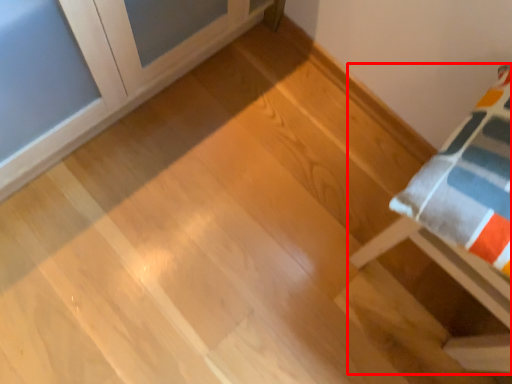
Question: From the image's perspective, where is furniture (annotated by the red box) located relative to furniture?

Choices:
 (A) below
 (B) above

Answer: (A)